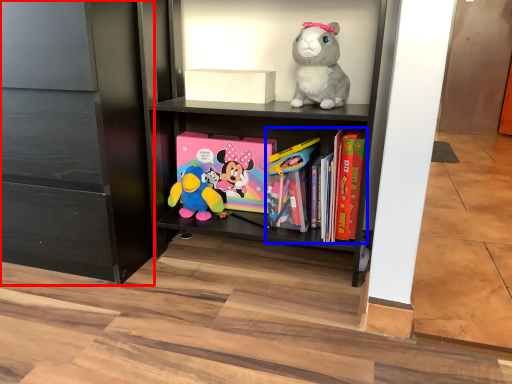
Question: Which of the following is the farthest to the observer, cabinetry (highlighted by a red box) or book (highlighted by a blue box)?

Choices:
 (A) cabinetry
 (B) book

Answer: (B)